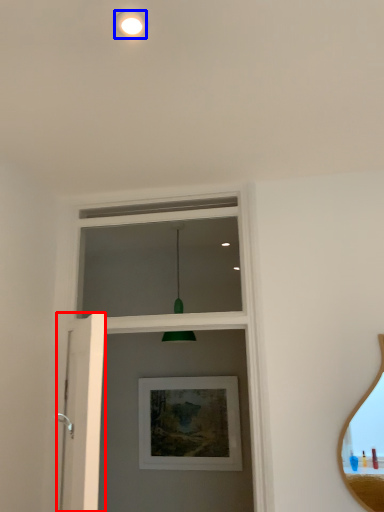
Question: Which object is further to the camera taking this photo, screen door (highlighted by a red box) or droplight (highlighted by a blue box)?

Choices:
 (A) screen door
 (B) droplight

Answer: (A)